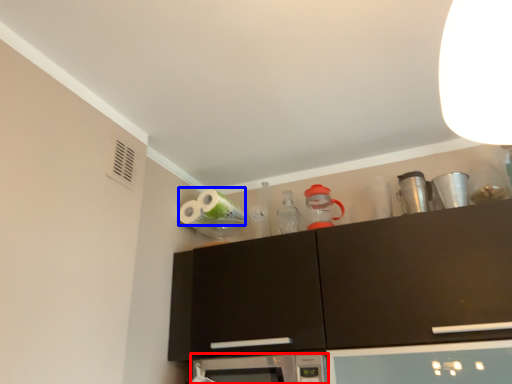
Question: Among these objects, which one is farthest to the camera, microwave oven (highlighted by a red box) or toilet paper (highlighted by a blue box)?

Choices:
 (A) microwave oven
 (B) toilet paper

Answer: (B)